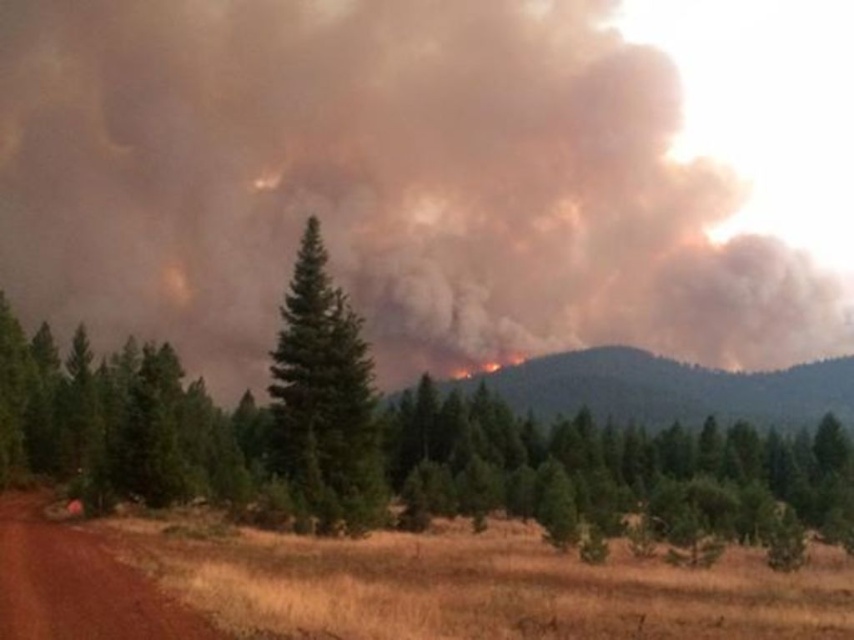
Who is shorter, green textured pine tree at center or brown dirt track at lower left?

With less height is brown dirt track at lower left.

Is green textured pine tree at center further to the viewer compared to brown dirt track at lower left?

Yes, it is behind brown dirt track at lower left.

Does point (334, 484) come closer to viewer compared to point (3, 518)?

No, it is not.

Find the location of `green textured pine tree at center`. green textured pine tree at center is located at coordinates (325, 397).

In the scene shown: Does charred vegetation at center appear on the right side of brown dirt track at lower left?

Yes, charred vegetation at center is to the right of brown dirt track at lower left.

Is charred vegetation at center bigger than brown dirt track at lower left?

Indeed, charred vegetation at center has a larger size compared to brown dirt track at lower left.

Who is more distant from viewer, (656, 401) or (59, 554)?

The point (656, 401) is behind.

I want to click on charred vegetation at center, so click(x=668, y=388).

Is brown smoke at upper center further to camera compared to charred vegetation at center?

No, brown smoke at upper center is in front of charred vegetation at center.

The image size is (854, 640). What are the coordinates of `brown smoke at upper center` in the screenshot? It's located at (377, 182).